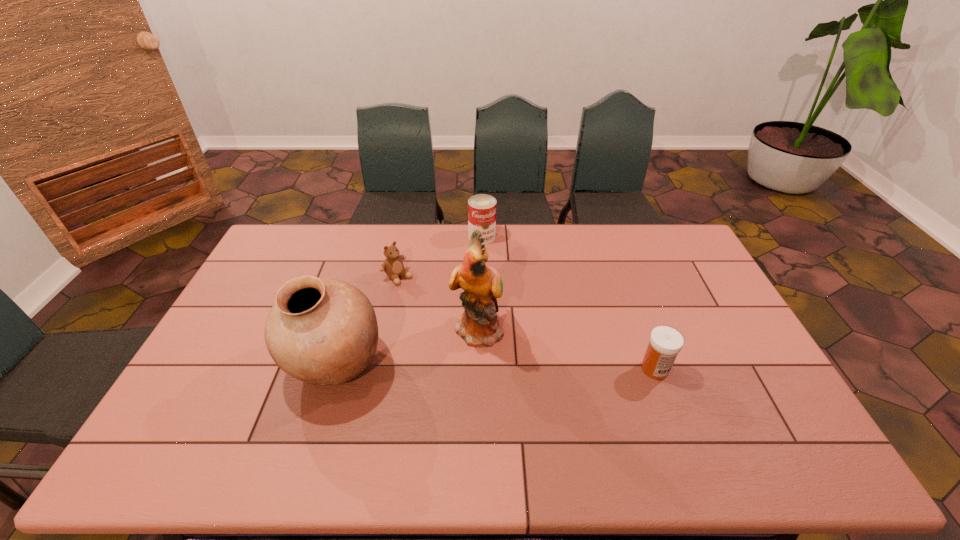
This screenshot has height=540, width=960. Find the location of `vacant spot on the desktop that is between the pottery and the medicine and is positioned on the front-facing side of the fourth nearest object`. vacant spot on the desktop that is between the pottery and the medicine and is positioned on the front-facing side of the fourth nearest object is located at coordinates [x=512, y=367].

Find the location of a particular element. This screenshot has height=540, width=960. free spot on the desktop that is between the pottery and the medicine and is positioned on the front-facing side of the parrot is located at coordinates (529, 367).

Where is `vacant spot on the desktop that is between the second tallest object and the rightmost object and is positioned on the front label of the farthest object`? vacant spot on the desktop that is between the second tallest object and the rightmost object and is positioned on the front label of the farthest object is located at coordinates (508, 367).